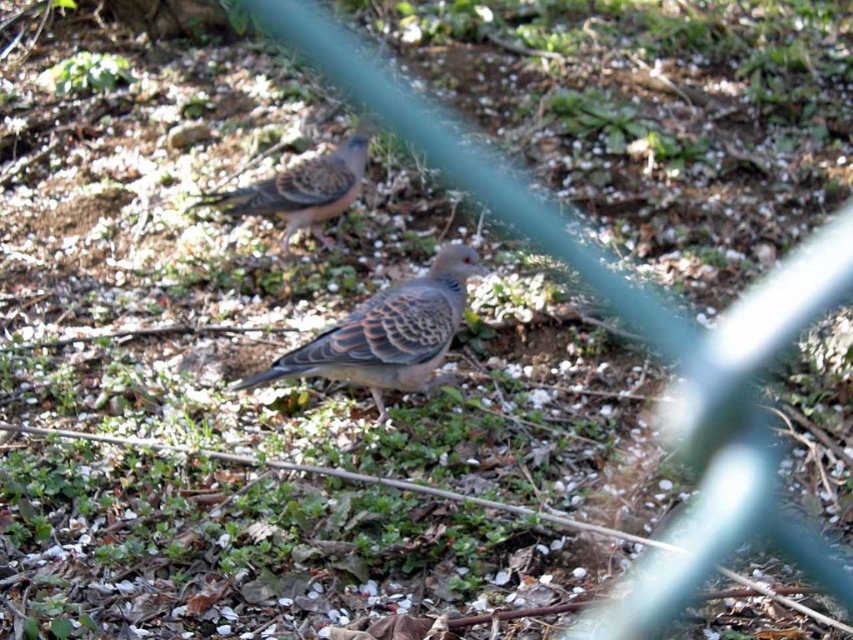
Can you confirm if speckled feathered pigeon at center is positioned to the right of speckled feathered bird at center?

Yes, speckled feathered pigeon at center is to the right of speckled feathered bird at center.

Is speckled feathered pigeon at center bigger than speckled feathered bird at center?

Actually, speckled feathered pigeon at center might be smaller than speckled feathered bird at center.

Is point (352, 342) positioned after point (309, 177)?

No, (352, 342) is in front of (309, 177).

This screenshot has height=640, width=853. I want to click on speckled feathered pigeon at center, so 387,332.